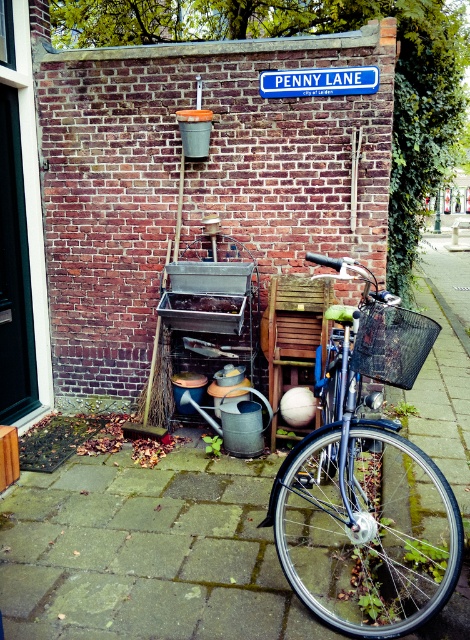
Does smooth concrete pavement at lower center have a lesser width compared to black woven basket at center?

No.

Who is positioned more to the right, smooth concrete pavement at lower center or black woven basket at center?

Positioned to the right is black woven basket at center.

Does point (302, 560) come in front of point (365, 323)?

No, (302, 560) is further to viewer.

Locate an element on the screen. This screenshot has height=640, width=470. smooth concrete pavement at lower center is located at coordinates (147, 554).

What are the coordinates of `shiny metallic bicycle at center` in the screenshot? It's located at (366, 483).

Can you confirm if shiny metallic bicycle at center is positioned to the left of black woven basket at center?

Yes, shiny metallic bicycle at center is to the left of black woven basket at center.

Who is more forward, (329, 476) or (388, 324)?

Point (388, 324)

Identify the location of shiny metallic bicycle at center. This screenshot has width=470, height=640. (366, 483).

Consider the image. Who is taller, shiny metallic bicycle at center or blue plastic street sign at upper center?

With more height is shiny metallic bicycle at center.

Does shiny metallic bicycle at center appear on the left side of blue plastic street sign at upper center?

No, shiny metallic bicycle at center is not to the left of blue plastic street sign at upper center.

Where is `shiny metallic bicycle at center`? The width and height of the screenshot is (470, 640). shiny metallic bicycle at center is located at coordinates (366, 483).